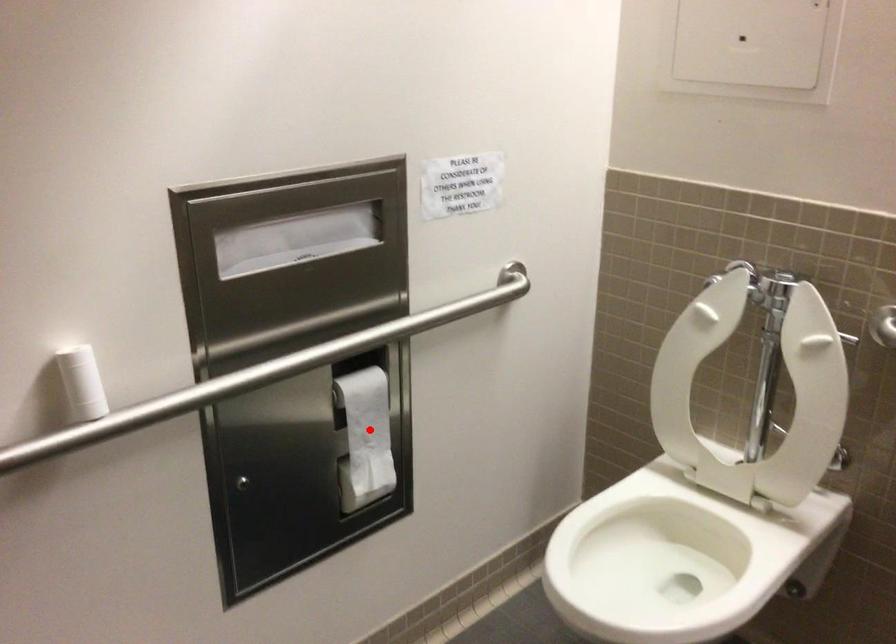
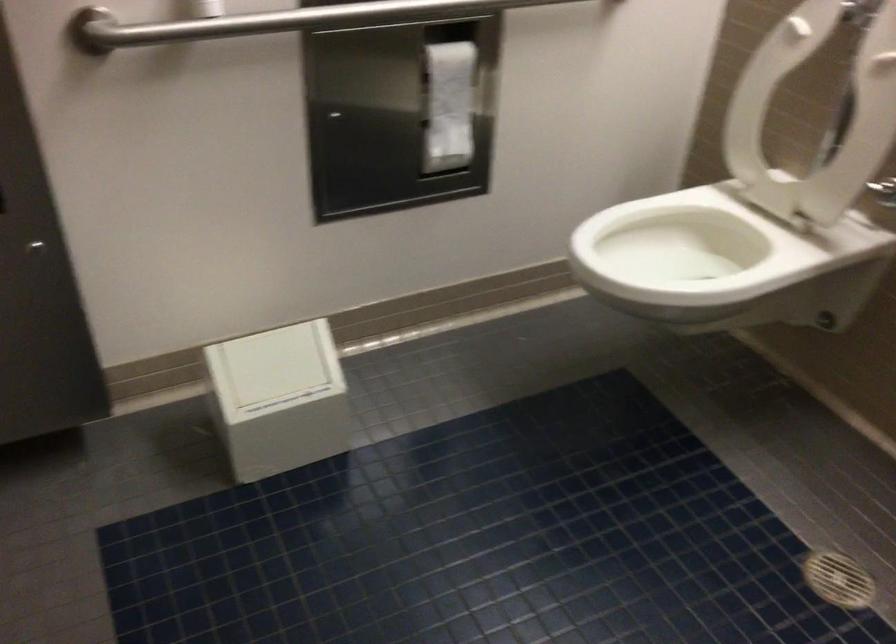
Question: I am providing you with two images of the same scene from different viewpoints. In image1, a red point is highlighted. Considering the same 3D point in image2, which of the following is correct?

Choices:
 (A) It is closer
 (B) It is farther

Answer: (B)